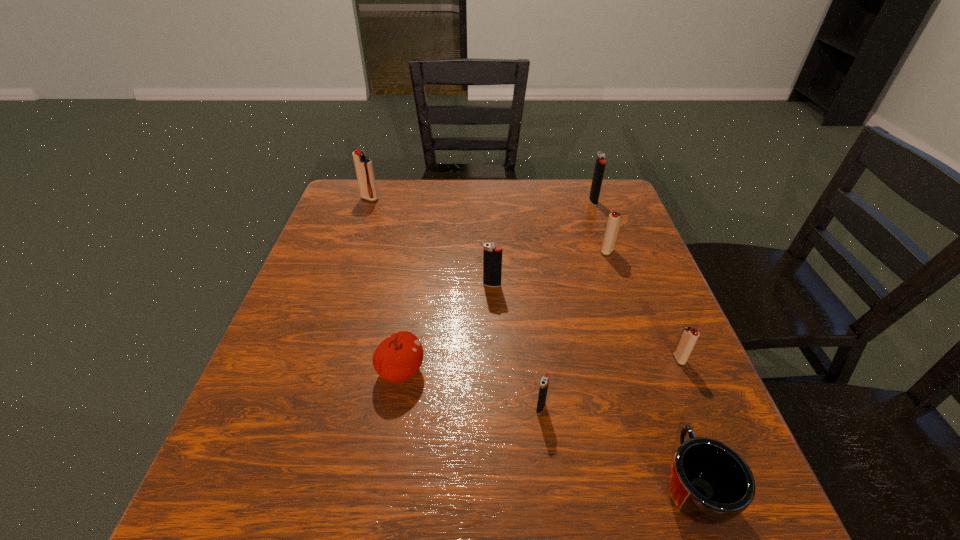
Locate an element on the screen. The image size is (960, 540). free space that is in between the fourth igniter from right to left and the leftmost object is located at coordinates (455, 303).

In order to click on vacant area between the seventh object from right to left and the rightmost red igniter in this screenshot , I will do `click(540, 365)`.

At what (x,y) coordinates should I click in order to perform the action: click on unoccupied position between the biggest red igniter and the second smallest red igniter. Please return your answer as a coordinate pair (x, y). The width and height of the screenshot is (960, 540). Looking at the image, I should click on (489, 225).

Image resolution: width=960 pixels, height=540 pixels. What are the coordinates of `free spot between the leftmost red igniter and the nearest object` in the screenshot? It's located at 531,342.

What are the coordinates of `vacant area that lies between the biggest black igniter and the third igniter from left to right` in the screenshot? It's located at (567, 304).

Identify the location of vacant space that is in between the fifth igniter from right to left and the fourth object from left to right. (516, 346).

Where is `free area in between the second smallest red igniter and the red mug`? The image size is (960, 540). free area in between the second smallest red igniter and the red mug is located at coordinates (649, 368).

The height and width of the screenshot is (540, 960). I want to click on the closest object to the second red igniter from right to left, so click(x=600, y=163).

Identify which object is the fifth nearest to the fourth farthest igniter. Please provide its 2D coordinates. Your answer should be formatted as a tuple, i.e. [(x, y)], where the tuple contains the x and y coordinates of a point satisfying the conditions above.

[(600, 163)]

In order to click on igniter that stands as the fourth closest to the red mug in this screenshot , I will do `click(614, 221)`.